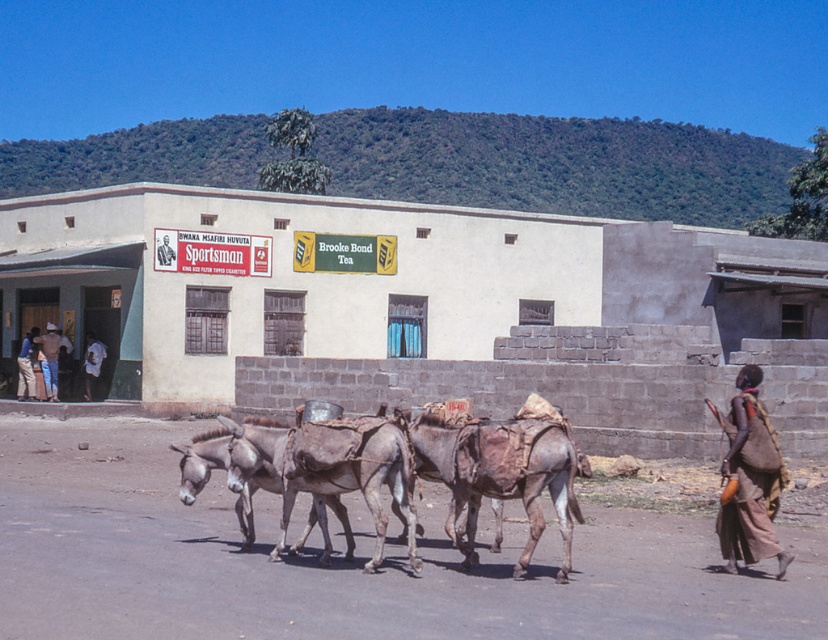
You are a traveler standing at the entrance of the building with the cigarette and tea ads. You need to reach the brown woven cloth at lower right to retrieve your package. Which direction should you move relative to the brown leather mule at center?

The brown leather mule at center is located below the brown woven cloth at lower right, so you should move upwards from the brown leather mule at center to reach the brown woven cloth at lower right.